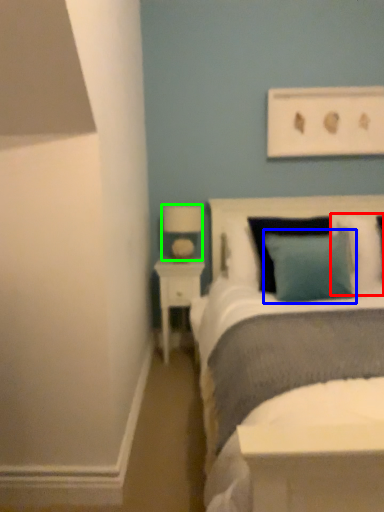
Question: Which object is positioned farthest from pillow (highlighted by a red box)? Select from pillow (highlighted by a blue box) and lamp (highlighted by a green box).

Choices:
 (A) pillow
 (B) lamp

Answer: (B)